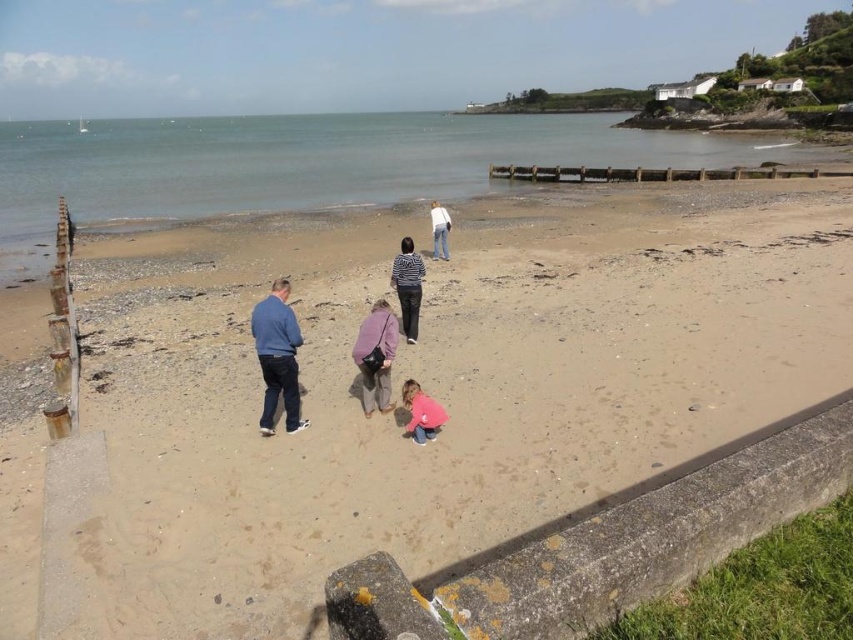
Is striped fabric shirt at center behind white cotton shirt at center?

No, striped fabric shirt at center is in front of white cotton shirt at center.

Can you confirm if striped fabric shirt at center is positioned to the left of white cotton shirt at center?

Answer: Correct, you'll find striped fabric shirt at center to the left of white cotton shirt at center.

The image size is (853, 640). Describe the element at coordinates (408, 285) in the screenshot. I see `striped fabric shirt at center` at that location.

I want to click on striped fabric shirt at center, so click(x=408, y=285).

What do you see at coordinates (277, 356) in the screenshot? I see `blue cotton shirt at lower left` at bounding box center [277, 356].

Can you confirm if blue cotton shirt at lower left is wider than striped fabric shirt at center?

Yes.

Does point (296, 412) come behind point (415, 314)?

That is False.

The image size is (853, 640). What are the coordinates of `blue cotton shirt at lower left` in the screenshot? It's located at (277, 356).

Does point (280, 342) lie in front of point (386, 316)?

Yes, point (280, 342) is in front of point (386, 316).

Is blue cotton shirt at lower left closer to camera compared to matte purple jacket at center?

Yes, blue cotton shirt at lower left is closer to the viewer.

Is point (265, 387) less distant than point (363, 392)?

No, it is behind (363, 392).

Where is `blue cotton shirt at lower left`? The height and width of the screenshot is (640, 853). blue cotton shirt at lower left is located at coordinates (277, 356).